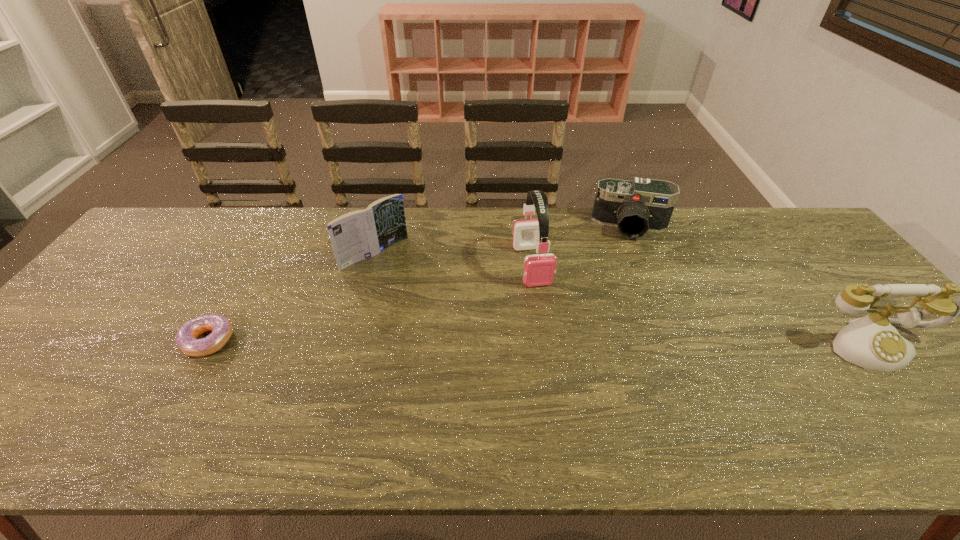
Locate an element on the screen. doughnut is located at coordinates point(222,329).

The height and width of the screenshot is (540, 960). Identify the location of the shortest object. pos(222,329).

Where is `the rightmost object`? Image resolution: width=960 pixels, height=540 pixels. the rightmost object is located at coordinates (872, 342).

This screenshot has width=960, height=540. Find the location of `the fourth object from right to left`. the fourth object from right to left is located at coordinates (361, 234).

Identify the location of the third object from right to left. This screenshot has height=540, width=960. (539, 269).

Image resolution: width=960 pixels, height=540 pixels. In order to click on earphone in this screenshot , I will do 539,269.

This screenshot has width=960, height=540. I want to click on camera, so click(x=641, y=205).

Locate an element on the screen. This screenshot has width=960, height=540. the second object from right to left is located at coordinates (641, 205).

I want to click on vacant space located on the left of the doughnut, so click(77, 341).

Find the location of a particular element. The width and height of the screenshot is (960, 540). free space located 0.050m on the dial of the telephone is located at coordinates (910, 392).